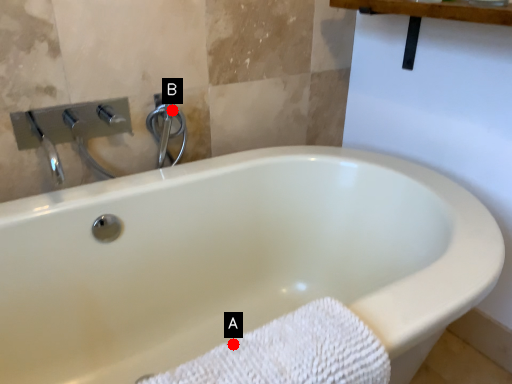
Question: Two points are circled on the image, labeled by A and B beside each circle. Which point appears farthest from the camera in this image?

Choices:
 (A) A is further
 (B) B is further

Answer: (B)